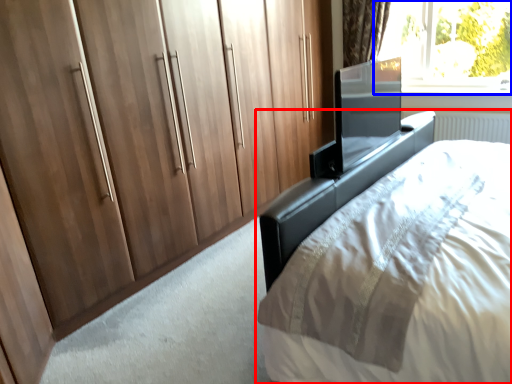
Question: Which point is closer to the camera, bed (highlighted by a red box) or window (highlighted by a blue box)?

Choices:
 (A) bed
 (B) window

Answer: (A)